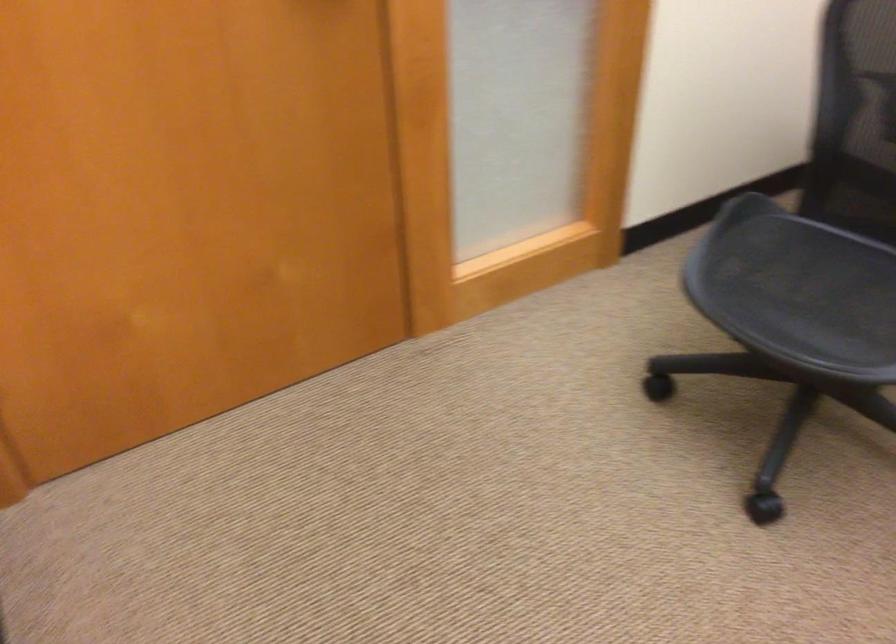
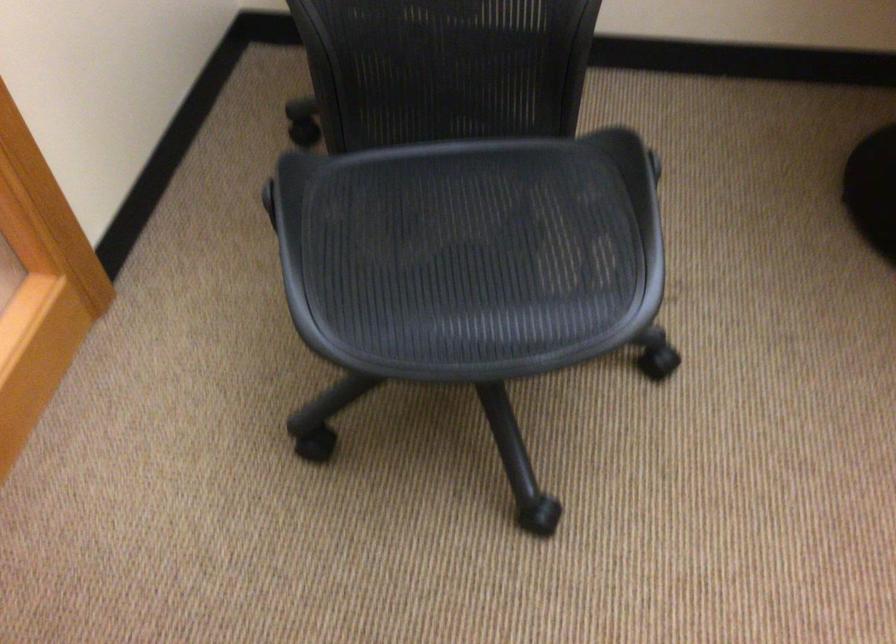
Locate, in the second image, the point that corresponds to pixel 815 290 in the first image.

(470, 254)